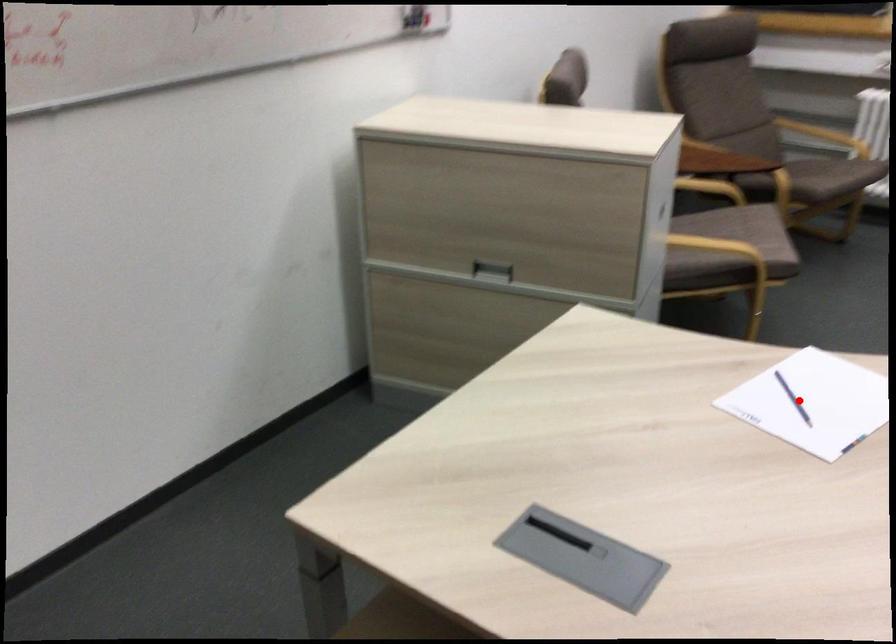
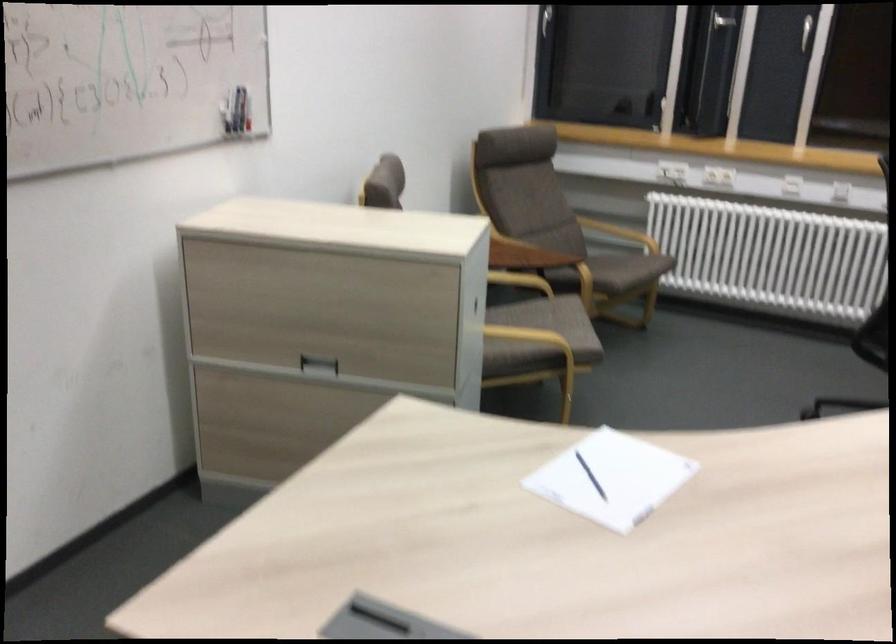
Question: I am providing you with two images of the same scene from different viewpoints. In image1, a red point is highlighted. Considering the same 3D point in image2, which of the following is correct?

Choices:
 (A) It is closer
 (B) It is farther

Answer: (B)